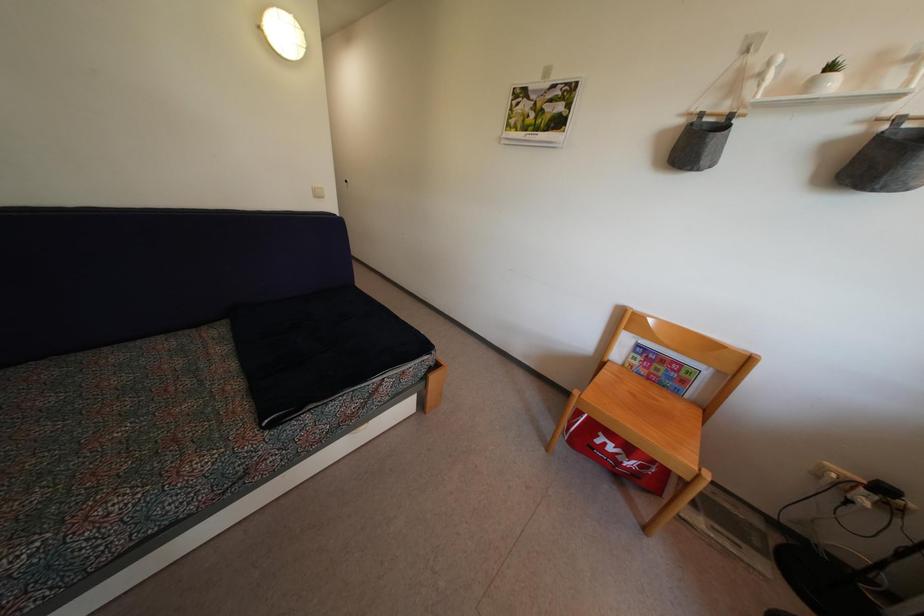
Find where to sit the chair sitting surface. Please return your answer as a coordinate pair (x, y).

(647, 416)